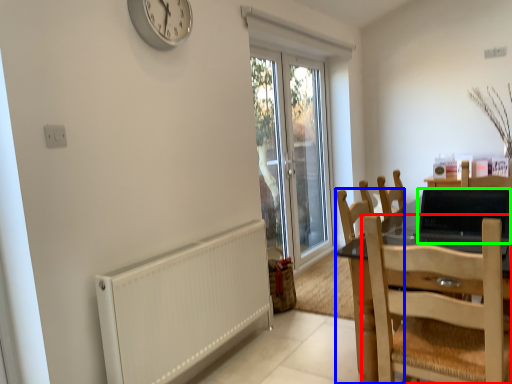
Question: Estimate the real-world distances between objects in this image. Which object is closer to chair (highlighted by a red box), chair (highlighted by a blue box) or laptop (highlighted by a green box)?

Choices:
 (A) chair
 (B) laptop

Answer: (A)